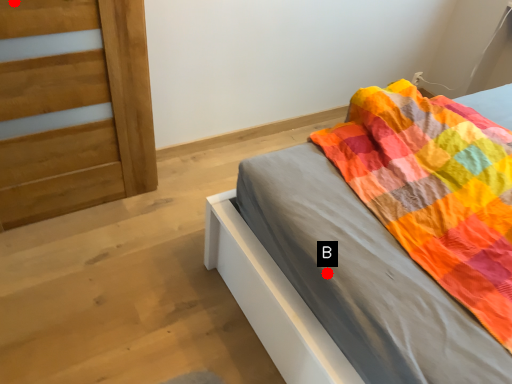
Question: Two points are circled on the image, labeled by A and B beside each circle. Which point is farther to the camera?

Choices:
 (A) A is further
 (B) B is further

Answer: (A)